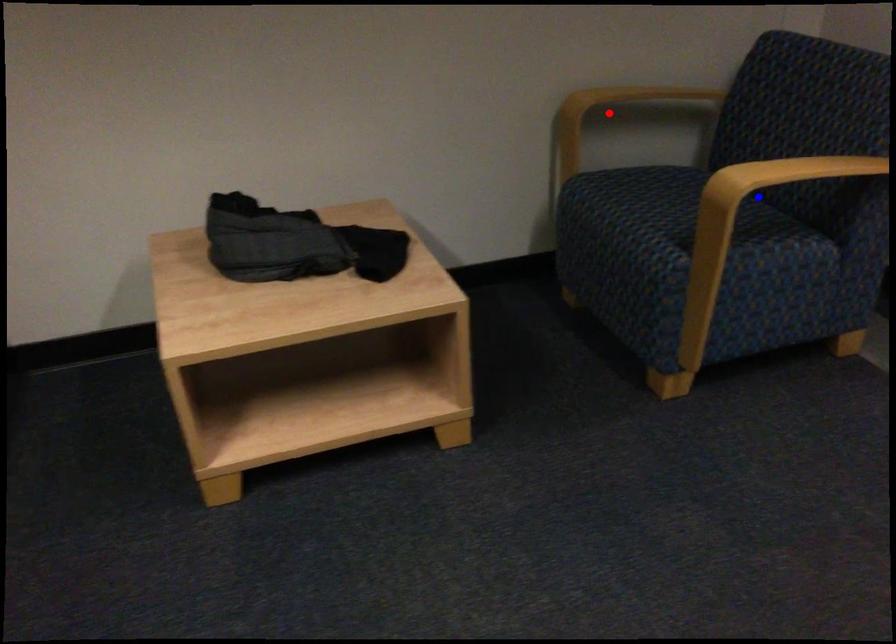
Question: Two points are marked on the image. Which point is closer to the camera?

Choices:
 (A) Blue point is closer.
 (B) Red point is closer.

Answer: (A)